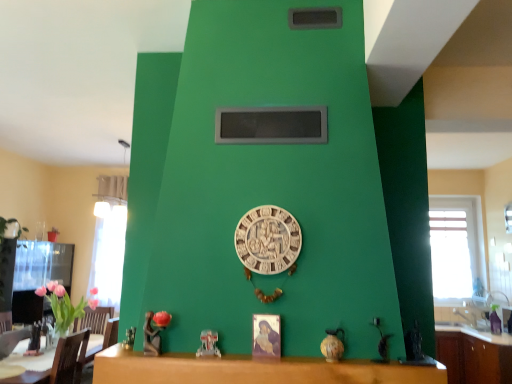
Question: Does brown leather armchair at lower left have a lesser height compared to wooden table at center?

Choices:
 (A) yes
 (B) no

Answer: (B)

Question: From the image's perspective, does brown leather armchair at lower left appear higher than wooden table at center?

Choices:
 (A) no
 (B) yes

Answer: (A)

Question: Considering the relative positions of brown leather armchair at lower left and wooden table at center in the image provided, is brown leather armchair at lower left behind wooden table at center?

Choices:
 (A) yes
 (B) no

Answer: (A)

Question: From a real-world perspective, is brown leather armchair at lower left physically below wooden table at center?

Choices:
 (A) no
 (B) yes

Answer: (B)

Question: Is brown leather armchair at lower left at the right side of wooden table at center?

Choices:
 (A) no
 (B) yes

Answer: (A)

Question: Can you confirm if brown leather armchair at lower left is thinner than wooden table at center?

Choices:
 (A) yes
 (B) no

Answer: (A)

Question: Is transparent glass window at right, which is the 2th window from left to right, to the right of brown wood cabinet at lower right from the viewer's perspective?

Choices:
 (A) yes
 (B) no

Answer: (A)

Question: Is transparent glass window at right, which is the 2th window from left to right, thinner than brown wood cabinet at lower right?

Choices:
 (A) yes
 (B) no

Answer: (A)

Question: Is transparent glass window at right, acting as the 1th window starting from the right, wider than brown wood cabinet at lower right?

Choices:
 (A) no
 (B) yes

Answer: (A)

Question: Can you confirm if transparent glass window at right, acting as the 1th window starting from the right, is taller than brown wood cabinet at lower right?

Choices:
 (A) yes
 (B) no

Answer: (A)

Question: Can you confirm if transparent glass window at right, acting as the 1th window starting from the right, is bigger than brown wood cabinet at lower right?

Choices:
 (A) yes
 (B) no

Answer: (B)

Question: Is transparent glass window at right, acting as the 1th window starting from the right, shorter than brown wood cabinet at lower right?

Choices:
 (A) yes
 (B) no

Answer: (B)

Question: From a real-world perspective, is brown leather armchair at lower left on transparent glass window at right, acting as the 1th window starting from the right?

Choices:
 (A) yes
 (B) no

Answer: (B)